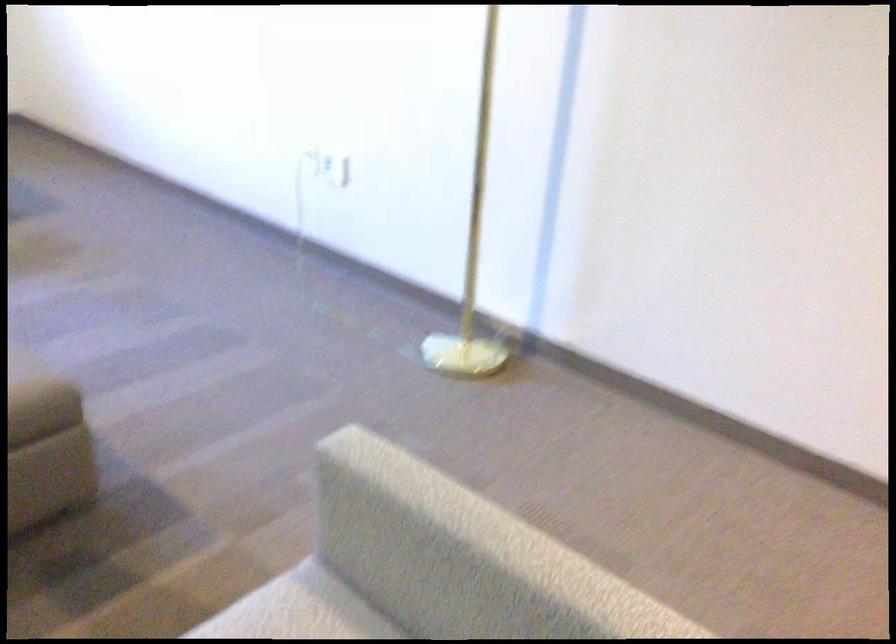
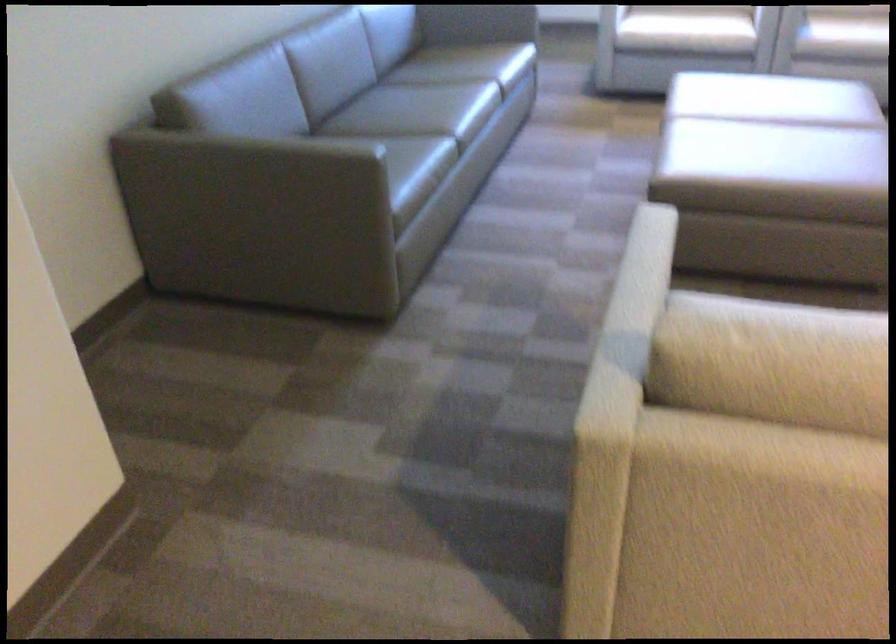
Based on the continuous images, in which direction is the camera rotating?

The camera's rotation is toward left-down.